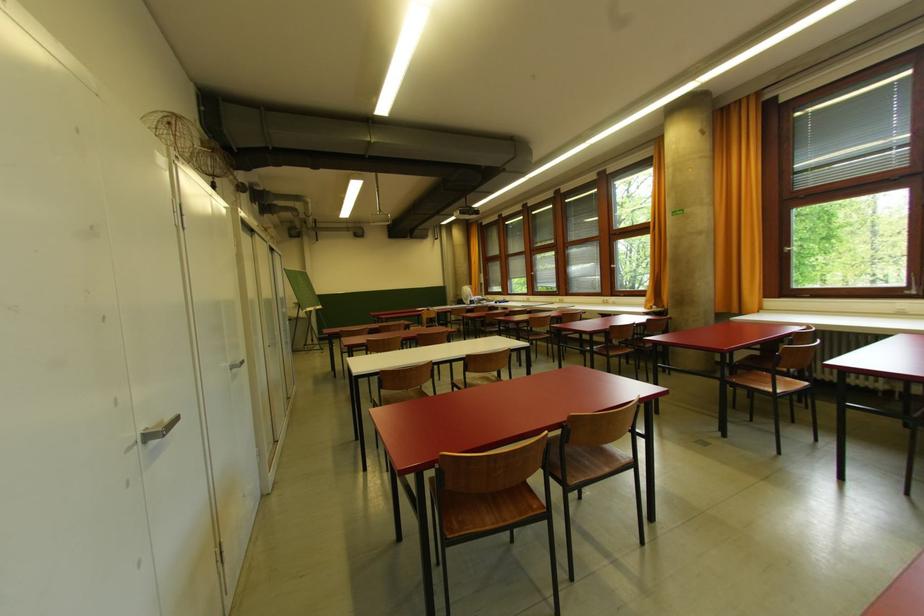
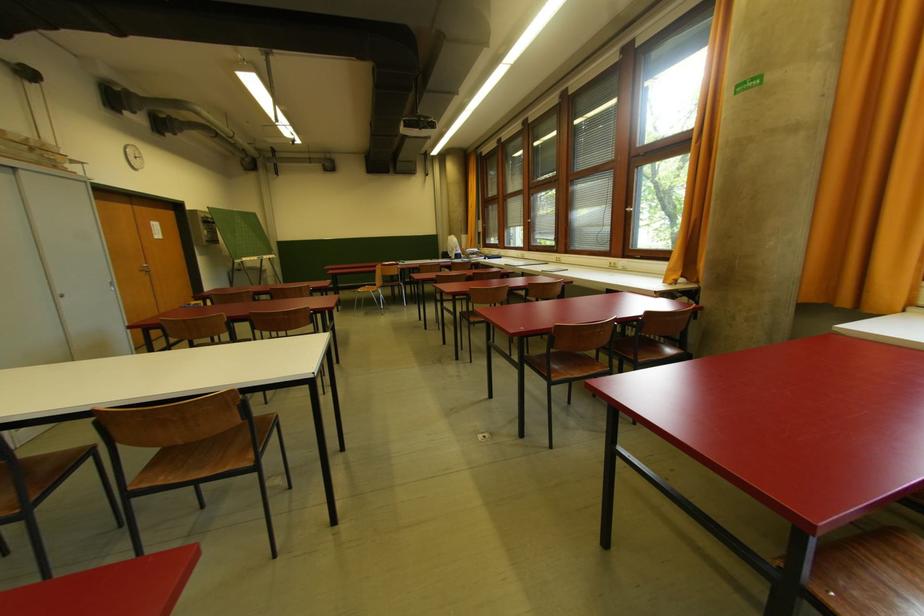
What movement of the cameraman would produce the second image?

The movement direction of the cameraman is right, forward.